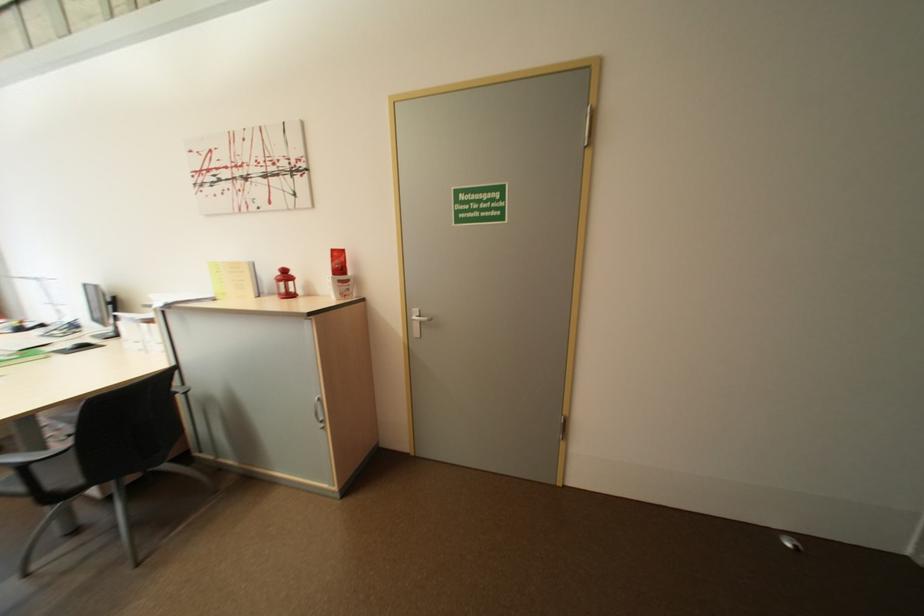
The image size is (924, 616). What do you see at coordinates (58, 466) in the screenshot?
I see `the chair sitting surface` at bounding box center [58, 466].